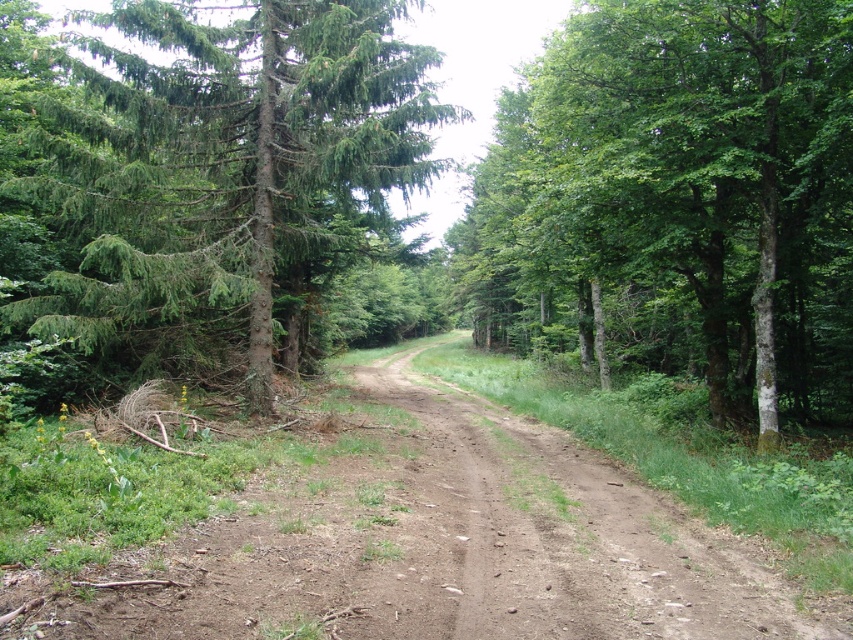
You are a hiker who wants to take a shortcut through the forest. You notice two trees, the green leafy tree at center and the green matte tree at upper left. Which tree has a narrower trunk? Please answer based on the description provided.

The green leafy tree at center has a lesser width compared to the green matte tree at upper left, so the green leafy tree at center has a narrower trunk.

You are a hiker standing at the point marked by the coordinates point (683,193). You want to walk towards the tall evergreen trees on the left side of the path. Which direction should you go?

The point (683,193) is at the green leafy tree at center. To reach the tall evergreen trees on the left side of the path, you should go to the left.